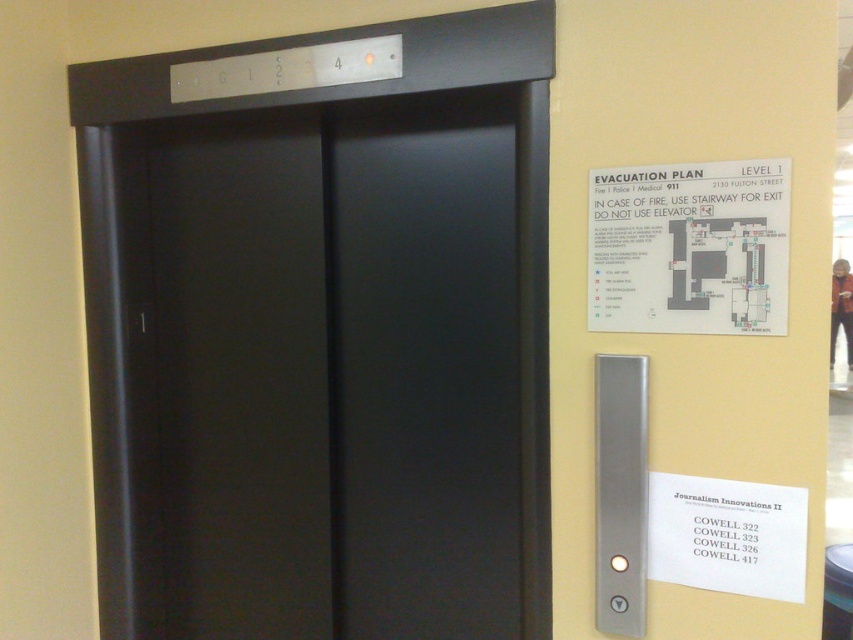
Is matte black elevator at center wider than satin black door at center?

Indeed, matte black elevator at center has a greater width compared to satin black door at center.

The height and width of the screenshot is (640, 853). In order to click on matte black elevator at center in this screenshot , I will do `click(321, 332)`.

Is point (459, 61) less distant than point (451, 461)?

Yes, point (459, 61) is in front of point (451, 461).

At what (x,y) coordinates should I click in order to perform the action: click on matte black elevator at center. Please return your answer as a coordinate pair (x, y). Looking at the image, I should click on (321, 332).

Is satin black door at center thinner than white paper map at upper right?

In fact, satin black door at center might be wider than white paper map at upper right.

Between satin black door at center and white paper map at upper right, which one is positioned higher?

Positioned higher is white paper map at upper right.

This screenshot has height=640, width=853. I want to click on satin black door at center, so click(425, 364).

Does matte black elevator at center appear on the right side of white paper map at upper right?

No, matte black elevator at center is not to the right of white paper map at upper right.

Is matte black elevator at center wider than white paper map at upper right?

Correct, the width of matte black elevator at center exceeds that of white paper map at upper right.

Is point (137, 404) farther from camera compared to point (764, 285)?

That is True.

Where is `matte black elevator at center`? This screenshot has height=640, width=853. matte black elevator at center is located at coordinates [321, 332].